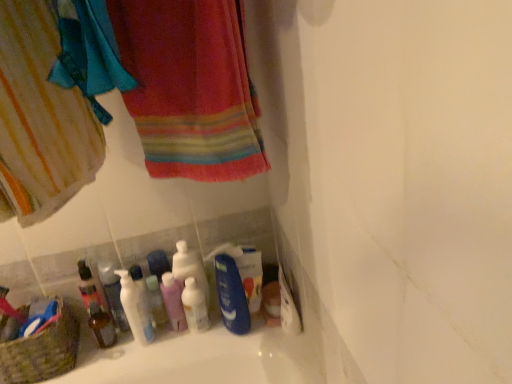
Question: Does multicolored woven towel at upper left have a greater width compared to textured wicker basket at lower left?

Choices:
 (A) yes
 (B) no

Answer: (A)

Question: Can you see multicolored woven towel at upper left touching textured wicker basket at lower left?

Choices:
 (A) no
 (B) yes

Answer: (A)

Question: Can you confirm if multicolored woven towel at upper left is smaller than textured wicker basket at lower left?

Choices:
 (A) no
 (B) yes

Answer: (A)

Question: Considering the relative sizes of multicolored woven towel at upper left and textured wicker basket at lower left in the image provided, is multicolored woven towel at upper left taller than textured wicker basket at lower left?

Choices:
 (A) yes
 (B) no

Answer: (A)

Question: Can you confirm if multicolored woven towel at upper left is bigger than textured wicker basket at lower left?

Choices:
 (A) yes
 (B) no

Answer: (A)

Question: Could textured wicker basket at lower left be considered to be inside multicolored woven towel at upper left?

Choices:
 (A) yes
 (B) no

Answer: (B)

Question: From the image's perspective, is white glossy mouthwash at lower left, positioned as the 2th mouthwash in left-to-right order, on pink plastic mouthwash at center, the 3th mouthwash from the left?

Choices:
 (A) no
 (B) yes

Answer: (B)

Question: Can you see white glossy mouthwash at lower left, positioned as the 2th mouthwash in left-to-right order, touching pink plastic mouthwash at center, positioned as the second mouthwash in right-to-left order?

Choices:
 (A) yes
 (B) no

Answer: (B)

Question: Is pink plastic mouthwash at center, positioned as the second mouthwash in right-to-left order, at the back of white glossy mouthwash at lower left, acting as the 3th mouthwash starting from the right?

Choices:
 (A) yes
 (B) no

Answer: (B)

Question: Is white glossy mouthwash at lower left, positioned as the 2th mouthwash in left-to-right order, far away from pink plastic mouthwash at center, positioned as the second mouthwash in right-to-left order?

Choices:
 (A) yes
 (B) no

Answer: (B)

Question: Is white glossy mouthwash at lower left, acting as the 3th mouthwash starting from the right, shorter than pink plastic mouthwash at center, the 3th mouthwash from the left?

Choices:
 (A) no
 (B) yes

Answer: (A)

Question: Does white glossy mouthwash at lower left, acting as the 3th mouthwash starting from the right, lie in front of pink plastic mouthwash at center, positioned as the second mouthwash in right-to-left order?

Choices:
 (A) no
 (B) yes

Answer: (A)

Question: Is textured wicker basket at lower left looking in the opposite direction of white glossy pump bottle at lower left, positioned as the 3th cleaning product in right-to-left order?

Choices:
 (A) no
 (B) yes

Answer: (A)